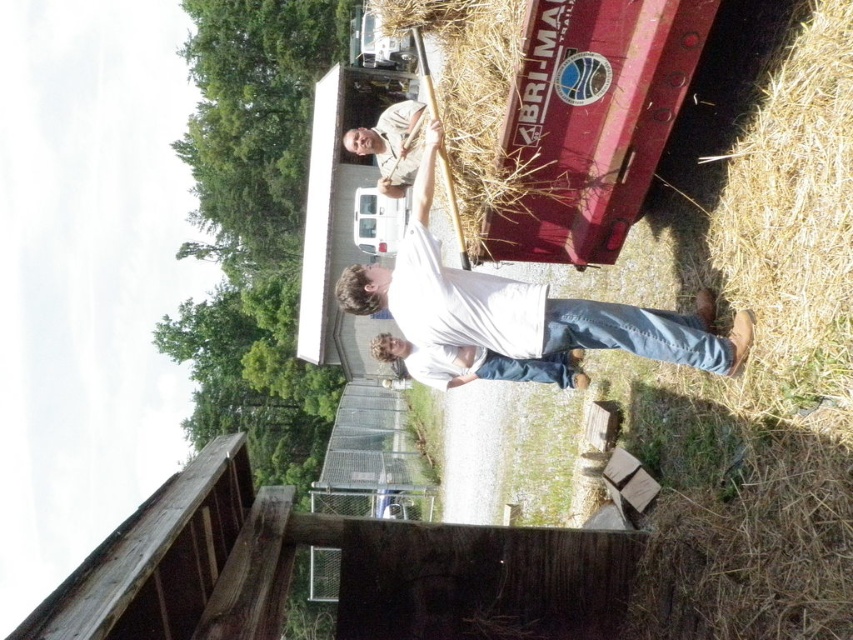
Question: Estimate the real-world distances between objects in this image. Which object is farther from the white cotton shirt at center?

Choices:
 (A) denim jeans at lower right
 (B) camouflage shirt at upper center
 (C) light brown straw at lower right

Answer: (B)

Question: Is the position of white cotton shirt at center more distant than that of camouflage shirt at upper center?

Choices:
 (A) yes
 (B) no

Answer: (B)

Question: Which object appears farthest from the camera in this image?

Choices:
 (A) white cotton shirt at center
 (B) light brown straw at lower right
 (C) camouflage shirt at upper center

Answer: (C)

Question: Can you confirm if light brown straw at lower right is thinner than camouflage shirt at upper center?

Choices:
 (A) no
 (B) yes

Answer: (B)

Question: Is light brown straw at lower right to the left of white cotton shirt at center from the viewer's perspective?

Choices:
 (A) yes
 (B) no

Answer: (B)

Question: Which object is closer to the camera taking this photo?

Choices:
 (A) white cotton shirt at center
 (B) camouflage shirt at upper center
 (C) denim jeans at lower right
 (D) light brown straw at lower right

Answer: (D)